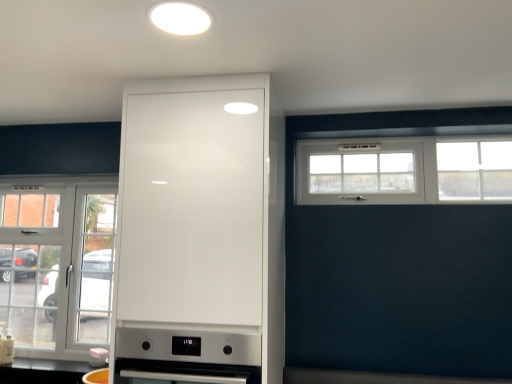
Question: From a real-world perspective, is white matte light fixture at upper center physically located above or below white glossy cabinet at center?

Choices:
 (A) above
 (B) below

Answer: (A)

Question: Considering their positions, is white matte light fixture at upper center located in front of or behind white glossy cabinet at center?

Choices:
 (A) behind
 (B) front

Answer: (B)

Question: Considering the real-world distances, which object is farthest from the white glossy cabinet at center?

Choices:
 (A) satin silver oven at center, marked as the 2th appliance in a back-to-front arrangement
 (B) clear glass door at left, the first window from the back
 (C) matte white kettle at lower center, the first appliance when ordered from bottom to top
 (D) white matte light fixture at upper center
 (E) white plastic window at upper right, which is counted as the 1th window, starting from the front

Answer: (C)

Question: Considering the real-world distances, which object is closest to the white plastic window at upper right, which is counted as the 1th window, starting from the front?

Choices:
 (A) white matte light fixture at upper center
 (B) matte white kettle at lower center, the first appliance when ordered from bottom to top
 (C) white glossy cabinet at center
 (D) clear glass door at left, marked as the second window in a front-to-back arrangement
 (E) satin silver oven at center, placed as the second appliance when sorted from left to right

Answer: (C)